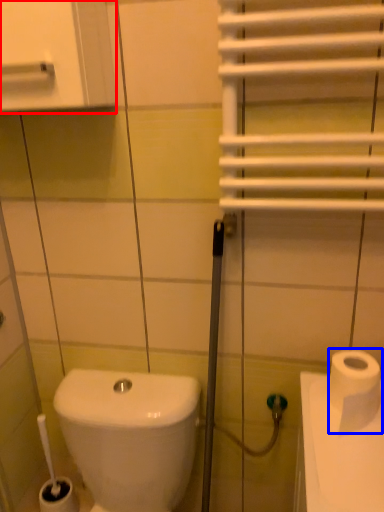
Question: Which object is closer to the camera taking this photo, medicine cabinet (highlighted by a red box) or toilet paper (highlighted by a blue box)?

Choices:
 (A) medicine cabinet
 (B) toilet paper

Answer: (A)